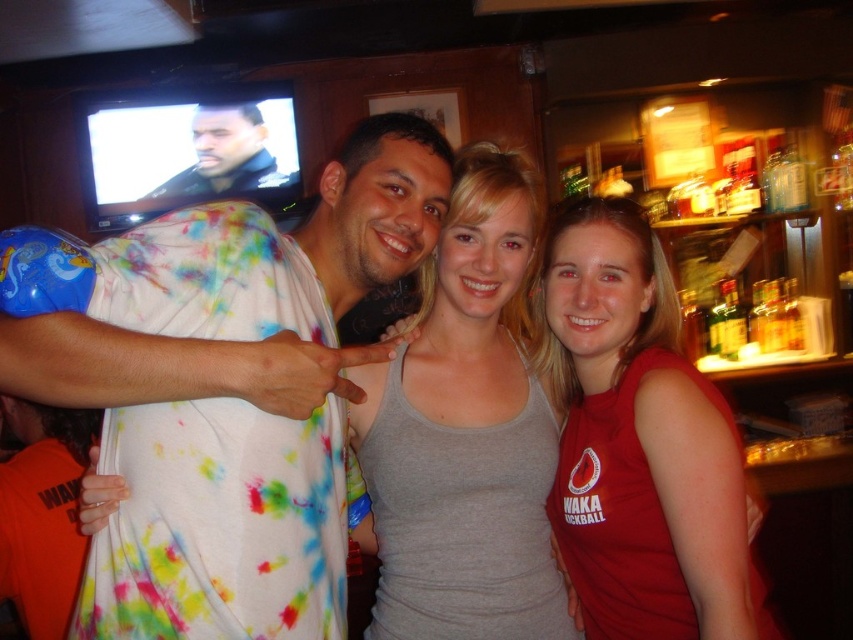
Question: Does gray matte tank top at center appear on the right side of dark blue leather jacket at upper left?

Choices:
 (A) no
 (B) yes

Answer: (B)

Question: Can you confirm if gray matte tank top at center is bigger than dark blue leather jacket at upper left?

Choices:
 (A) no
 (B) yes

Answer: (B)

Question: From the image, what is the correct spatial relationship of gray matte tank top at center in relation to dark blue leather jacket at upper left?

Choices:
 (A) right
 (B) left

Answer: (A)

Question: Which of the following is the farthest from the observer?

Choices:
 (A) (505, 189)
 (B) (326, 305)

Answer: (A)

Question: Which object is the closest to the matte red tank top at center?

Choices:
 (A) dark blue leather jacket at upper left
 (B) gray matte tank top at center
 (C) tie-dye fabric shirt at center

Answer: (B)

Question: Which object is positioned farthest from the tie-dye fabric shirt at center?

Choices:
 (A) dark blue leather jacket at upper left
 (B) matte red tank top at center
 (C) gray matte tank top at center

Answer: (A)